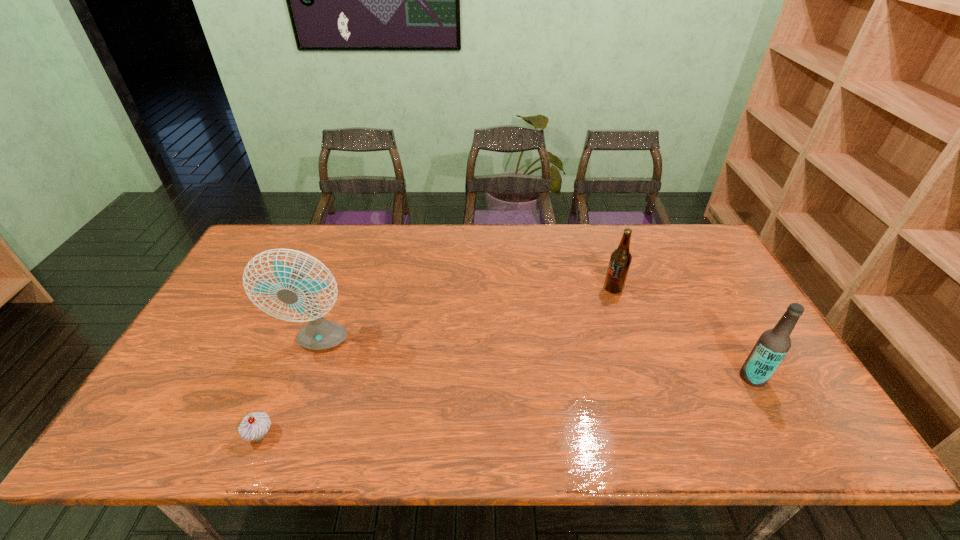
You are a GUI agent. You are given a task and a screenshot of the screen. Output one action in this format:
    pyautogui.click(x=<x>, y=<y>)
    Task: Click on the third nearest object
    The height and width of the screenshot is (540, 960).
    Given the screenshot: What is the action you would take?
    pyautogui.click(x=319, y=334)

Where is `the tallest object`? the tallest object is located at coordinates (319, 334).

You are a GUI agent. You are given a task and a screenshot of the screen. Output one action in this format:
    pyautogui.click(x=<x>, y=<y>)
    Task: Click on the right beer bottle
    
    Given the screenshot: What is the action you would take?
    pyautogui.click(x=773, y=344)

Where is `the third farthest object`? This screenshot has height=540, width=960. the third farthest object is located at coordinates (773, 344).

At what (x,y) coordinates should I click in order to perform the action: click on the farthest object. Please return your answer as a coordinate pair (x, y). Looking at the image, I should click on [x=620, y=260].

At what (x,y) coordinates should I click in order to perform the action: click on the left beer bottle. Please return your answer as a coordinate pair (x, y). The width and height of the screenshot is (960, 540). Looking at the image, I should click on (620, 260).

Identify the location of the nearest object. The width and height of the screenshot is (960, 540). (255, 426).

Find the location of `cupcake`. cupcake is located at coordinates (255, 426).

Identify the location of free point located on the front-facing side of the tallest object. The width and height of the screenshot is (960, 540). (305, 383).

You are a GUI agent. You are given a task and a screenshot of the screen. Output one action in this format:
    pyautogui.click(x=<x>, y=<y>)
    Task: Click on the free region located on the side of the rightmost object with the label
    
    Given the screenshot: What is the action you would take?
    pyautogui.click(x=652, y=377)